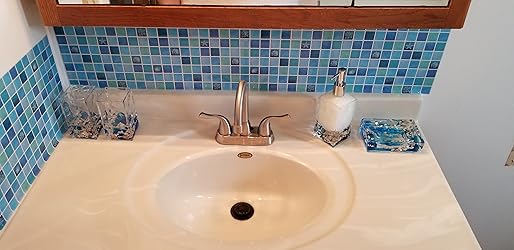
This screenshot has height=250, width=514. What are the coordinates of `wooden frame` in the screenshot? It's located at (231, 15).